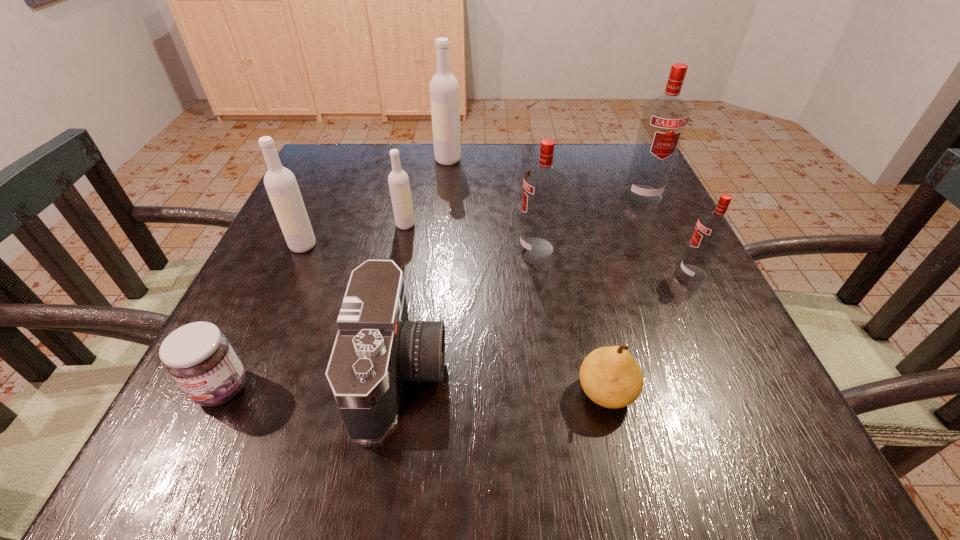
At what (x,y) coordinates should I click in order to perform the action: click on the farthest vodka. Please return your answer as a coordinate pair (x, y). This screenshot has width=960, height=540. Looking at the image, I should click on (444, 89).

Identify the location of the third vodka from left to right. (444, 89).

Identify the location of the farthest red vodka. (664, 119).

Locate an element on the screen. This screenshot has width=960, height=540. the eighth nearest object is located at coordinates (664, 119).

Find the location of a particular element. The image size is (960, 540). the leftmost red vodka is located at coordinates (543, 184).

Where is `the fourth vodka from left to right`? the fourth vodka from left to right is located at coordinates (543, 184).

Locate an element on the screen. This screenshot has width=960, height=540. the leftmost vodka is located at coordinates (280, 183).

This screenshot has width=960, height=540. I want to click on the second biggest white vodka, so click(280, 183).

The image size is (960, 540). In order to click on the nearest red vodka in this screenshot , I will do `click(713, 227)`.

Identify the location of the smallest red vodka. (713, 227).